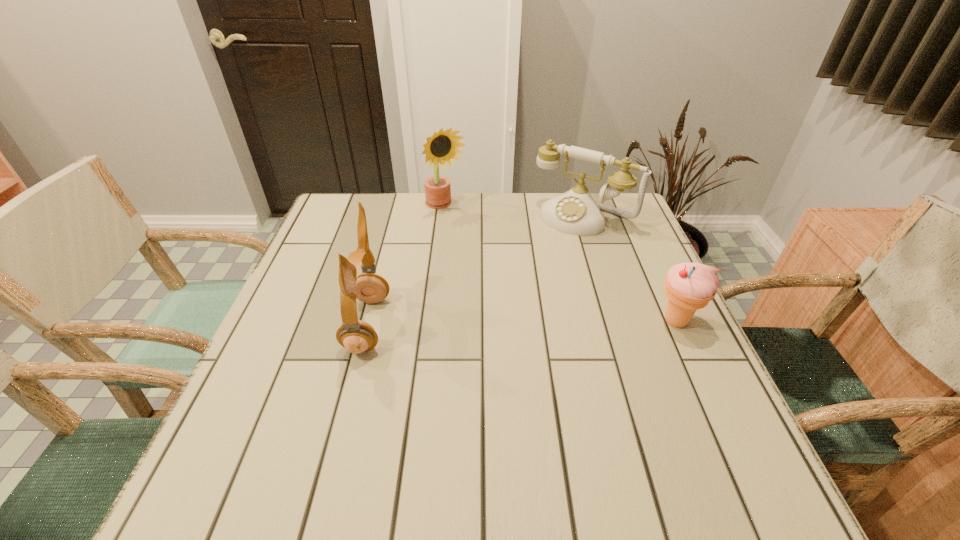
Find the location of `vacant area at the right edge of the desktop`. vacant area at the right edge of the desktop is located at coordinates (635, 355).

In the image, there is a desktop. Where is `free region at the far left corner`? This screenshot has width=960, height=540. free region at the far left corner is located at coordinates (344, 219).

At what (x,y) coordinates should I click in order to perform the action: click on vacant space at the far right corner of the desktop. Please return your answer as a coordinate pair (x, y). The width and height of the screenshot is (960, 540). Looking at the image, I should click on (631, 221).

Locate an element on the screen. This screenshot has height=540, width=960. free spot at the near right corner of the desktop is located at coordinates (677, 406).

Locate an element on the screen. free spot between the sunflower and the telephone is located at coordinates pyautogui.click(x=515, y=212).

Find the location of `vacant space that is in between the third object from right to left and the telephone`. vacant space that is in between the third object from right to left and the telephone is located at coordinates (515, 212).

Identify the location of vacant area that lies between the earphone and the icecream. The width and height of the screenshot is (960, 540). (521, 323).

Where is `vacant area between the telephone and the earphone`? vacant area between the telephone and the earphone is located at coordinates (475, 271).

At what (x,y) coordinates should I click in order to perform the action: click on free area in between the telephone and the earphone. Please return your answer as a coordinate pair (x, y). The height and width of the screenshot is (540, 960). Looking at the image, I should click on (475, 271).

Where is `empty space between the icecream and the leftmost object`? empty space between the icecream and the leftmost object is located at coordinates (521, 323).